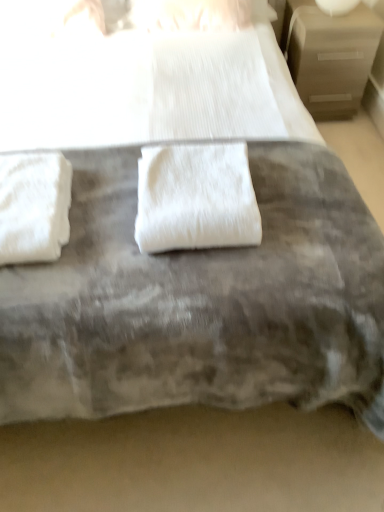
Question: Can you see white fluffy towel at center, which ranks as the second towel in left-to-right order, touching beige wood nightstand at upper right?

Choices:
 (A) no
 (B) yes

Answer: (A)

Question: Does white fluffy towel at center, which is counted as the first towel, starting from the right, have a greater width compared to beige wood nightstand at upper right?

Choices:
 (A) yes
 (B) no

Answer: (B)

Question: Could you tell me if white fluffy towel at center, which is counted as the first towel, starting from the right, is facing beige wood nightstand at upper right?

Choices:
 (A) no
 (B) yes

Answer: (A)

Question: Can you confirm if white fluffy towel at center, which is counted as the first towel, starting from the right, is smaller than beige wood nightstand at upper right?

Choices:
 (A) no
 (B) yes

Answer: (B)

Question: Considering the relative sizes of white fluffy towel at center, which is counted as the first towel, starting from the right, and beige wood nightstand at upper right in the image provided, is white fluffy towel at center, which is counted as the first towel, starting from the right, taller than beige wood nightstand at upper right?

Choices:
 (A) no
 (B) yes

Answer: (A)

Question: From a real-world perspective, does white fluffy towel at center, which ranks as the second towel in left-to-right order, stand above beige wood nightstand at upper right?

Choices:
 (A) no
 (B) yes

Answer: (B)

Question: Is beige wood nightstand at upper right completely or partially outside of white fluffy towel at left, which is the second towel from right to left?

Choices:
 (A) yes
 (B) no

Answer: (A)

Question: Is beige wood nightstand at upper right oriented away from white fluffy towel at left, which is the second towel from right to left?

Choices:
 (A) no
 (B) yes

Answer: (A)

Question: Is white fluffy towel at left, which is the second towel from right to left, located within beige wood nightstand at upper right?

Choices:
 (A) yes
 (B) no

Answer: (B)

Question: Considering the relative sizes of beige wood nightstand at upper right and white fluffy towel at left, which is the second towel from right to left, in the image provided, is beige wood nightstand at upper right smaller than white fluffy towel at left, which is the second towel from right to left,?

Choices:
 (A) yes
 (B) no

Answer: (B)

Question: Is beige wood nightstand at upper right aimed at white fluffy towel at left, which is the second towel from right to left?

Choices:
 (A) yes
 (B) no

Answer: (B)

Question: Is beige wood nightstand at upper right to the right of white fluffy towel at left, which is the second towel from right to left, from the viewer's perspective?

Choices:
 (A) no
 (B) yes

Answer: (B)

Question: Is white fluffy towel at center, which ranks as the second towel in left-to-right order, not close to white fluffy towel at left, which is the first towel from left to right?

Choices:
 (A) no
 (B) yes

Answer: (A)